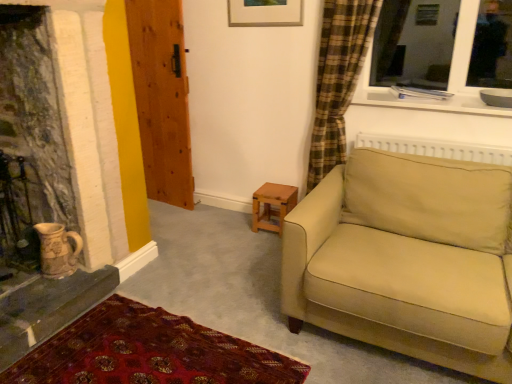
Question: Is beige fabric couch at right thinner than wooden table at center?

Choices:
 (A) yes
 (B) no

Answer: (B)

Question: Can you confirm if beige fabric couch at right is wider than wooden table at center?

Choices:
 (A) yes
 (B) no

Answer: (A)

Question: From the image's perspective, is beige fabric couch at right located above wooden table at center?

Choices:
 (A) yes
 (B) no

Answer: (B)

Question: Can you confirm if beige fabric couch at right is taller than wooden table at center?

Choices:
 (A) no
 (B) yes

Answer: (B)

Question: From the image's perspective, is beige fabric couch at right beneath wooden table at center?

Choices:
 (A) yes
 (B) no

Answer: (A)

Question: Considering their positions, is beige fabric couch at right located in front of or behind wooden door at left?

Choices:
 (A) behind
 (B) front

Answer: (B)

Question: From the image's perspective, is beige fabric couch at right positioned above or below wooden door at left?

Choices:
 (A) above
 (B) below

Answer: (B)

Question: From a real-world perspective, is beige fabric couch at right above or below wooden door at left?

Choices:
 (A) below
 (B) above

Answer: (A)

Question: Based on their positions, is beige fabric couch at right located to the left or right of wooden door at left?

Choices:
 (A) left
 (B) right

Answer: (B)

Question: Relative to carpet with intricate patterns at lower left, is earthenware jug at lower left in front or behind?

Choices:
 (A) behind
 (B) front

Answer: (A)

Question: Considering the positions of earthenware jug at lower left and carpet with intricate patterns at lower left in the image, is earthenware jug at lower left wider or thinner than carpet with intricate patterns at lower left?

Choices:
 (A) wide
 (B) thin

Answer: (B)

Question: From a real-world perspective, is earthenware jug at lower left above or below carpet with intricate patterns at lower left?

Choices:
 (A) above
 (B) below

Answer: (A)

Question: From their relative heights in the image, would you say earthenware jug at lower left is taller or shorter than carpet with intricate patterns at lower left?

Choices:
 (A) short
 (B) tall

Answer: (B)

Question: In the image, is earthenware jug at lower left positioned in front of or behind beige fabric couch at right?

Choices:
 (A) front
 (B) behind

Answer: (B)

Question: From the image's perspective, relative to beige fabric couch at right, is earthenware jug at lower left above or below?

Choices:
 (A) below
 (B) above

Answer: (A)